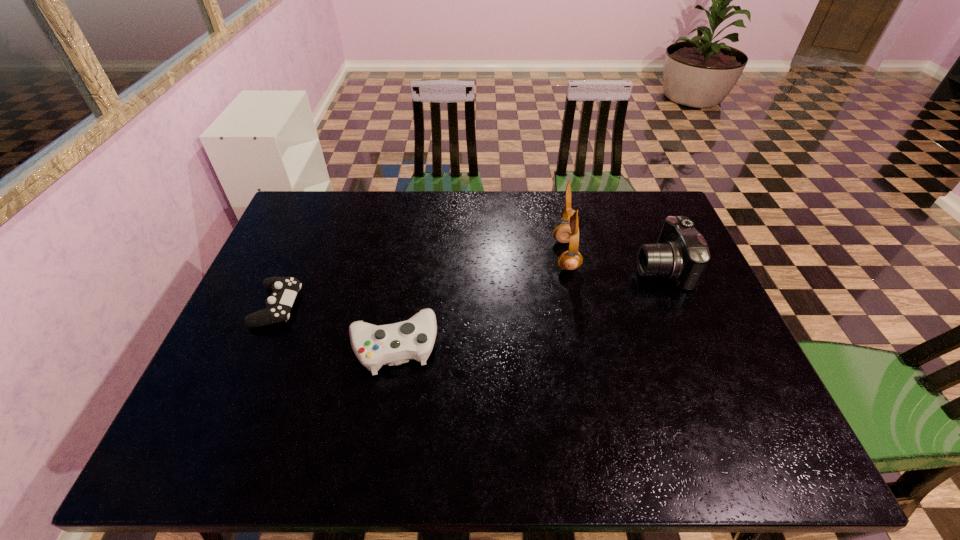
You are a GUI agent. You are given a task and a screenshot of the screen. Output one action in this format:
    pyautogui.click(x=<x>, y=<y>)
    Task: Click on the earphone
    
    Given the screenshot: What is the action you would take?
    [x=568, y=231]

The width and height of the screenshot is (960, 540). What are the coordinates of `the second object from right to left` in the screenshot? It's located at (568, 231).

At what (x,y) coordinates should I click in order to perform the action: click on the rightmost object. Please return your answer as a coordinate pair (x, y). Looking at the image, I should click on (681, 254).

You are a GUI agent. You are given a task and a screenshot of the screen. Output one action in this format:
    pyautogui.click(x=<x>, y=<y>)
    Task: Click on the camera
    Image resolution: width=960 pixels, height=540 pixels.
    Given the screenshot: What is the action you would take?
    pyautogui.click(x=681, y=254)

Locate an element on the screen. The width and height of the screenshot is (960, 540). the right control is located at coordinates (393, 344).

Find the location of `the second shortest object`. the second shortest object is located at coordinates (393, 344).

Find the location of a particular element. This screenshot has height=540, width=960. the left control is located at coordinates (285, 289).

At what (x,y) coordinates should I click in order to perform the action: click on the leftmost object. Please return your answer as a coordinate pair (x, y). Looking at the image, I should click on (285, 289).

Where is `vacant space located on the front-facing side of the earphone`? vacant space located on the front-facing side of the earphone is located at coordinates (491, 255).

Find the location of a particular element. The width and height of the screenshot is (960, 540). vacant space located 0.300m on the front-facing side of the earphone is located at coordinates (454, 255).